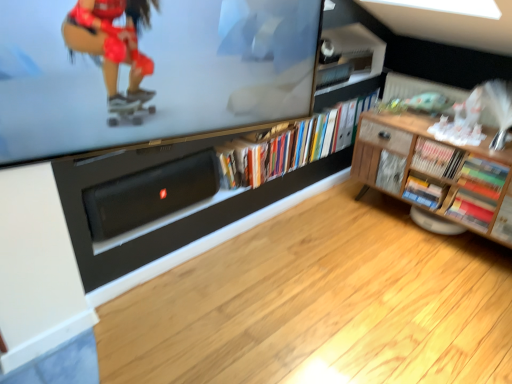
You are a GUI agent. You are given a task and a screenshot of the screen. Output one action in this format:
    pyautogui.click(x=<x>, y=<y>)
    Task: Click on the vacant space underneath matte black television at upper center (from a real-world perspective)
    The width and height of the screenshot is (512, 384).
    Given the screenshot: What is the action you would take?
    pyautogui.click(x=176, y=321)